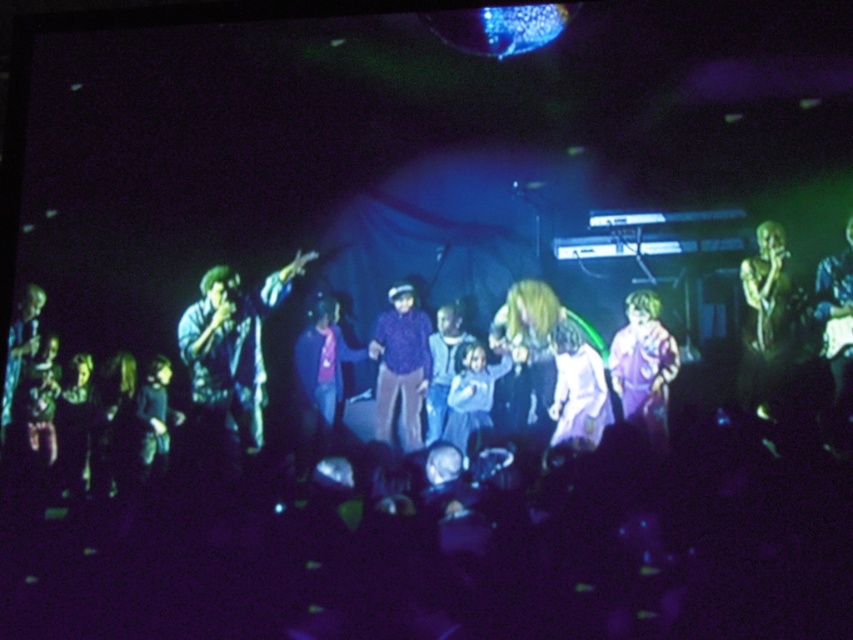
Which is more to the right, purple fabric at center or white fabric dress at center?

From the viewer's perspective, purple fabric at center appears more on the right side.

Who is more forward, (x=619, y=348) or (x=567, y=436)?

Point (x=567, y=436) is more forward.

Where is `purple fabric at center`? The width and height of the screenshot is (853, 640). purple fabric at center is located at coordinates (643, 365).

Is purple cotton shirt at center thinner than light blue fabric at center?

No.

Measure the distance between purple cotton shirt at center and light blue fabric at center.

purple cotton shirt at center is 1.99 inches away from light blue fabric at center.

What do you see at coordinates (401, 368) in the screenshot? This screenshot has height=640, width=853. I see `purple cotton shirt at center` at bounding box center [401, 368].

Image resolution: width=853 pixels, height=640 pixels. I want to click on purple cotton shirt at center, so click(x=401, y=368).

Which is above, white fabric dress at center or purple matte shirt at center?

purple matte shirt at center is above.

Who is positioned more to the right, white fabric dress at center or purple matte shirt at center?

Positioned to the right is white fabric dress at center.

This screenshot has height=640, width=853. I want to click on white fabric dress at center, so click(x=577, y=387).